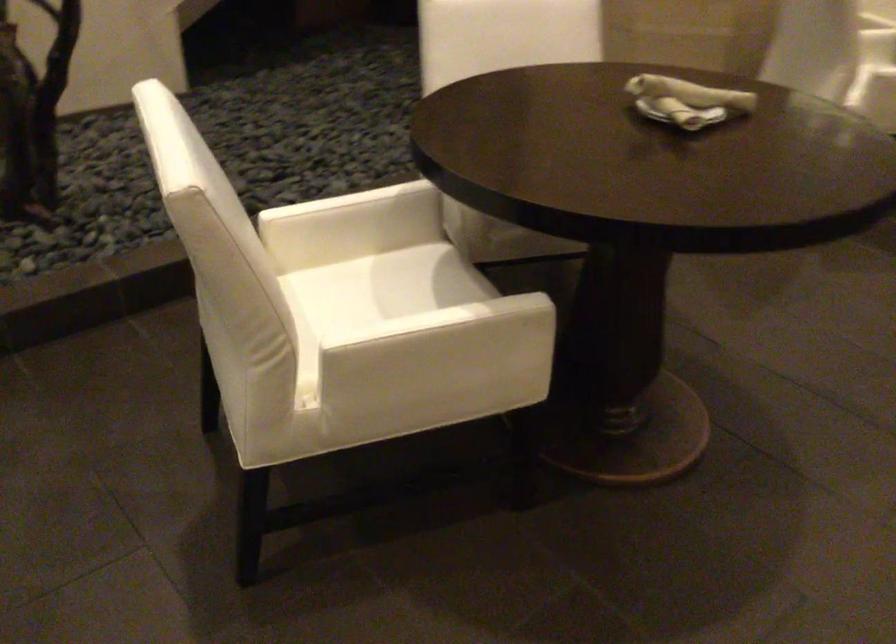
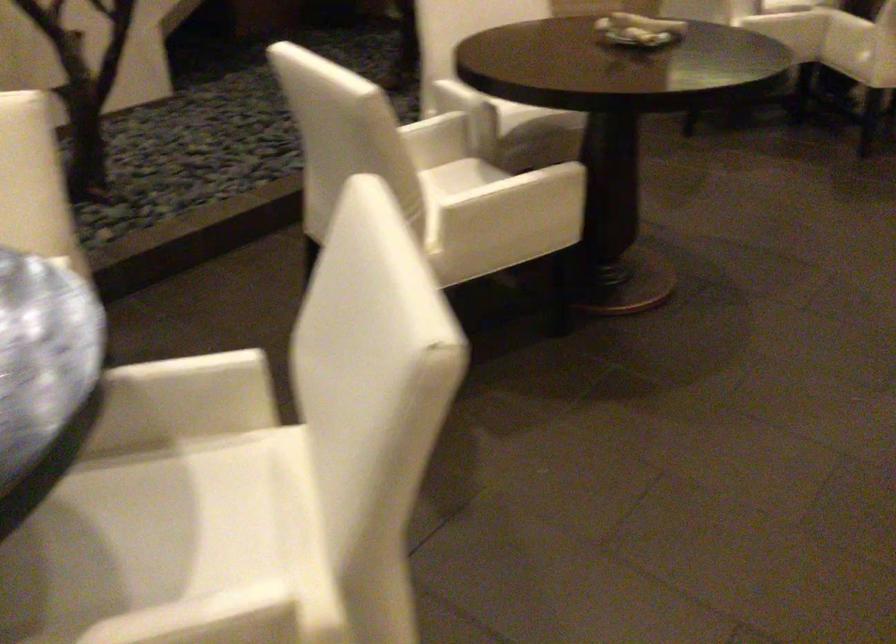
In the second image, find the point that corresponds to (x=440, y=339) in the first image.

(513, 196)